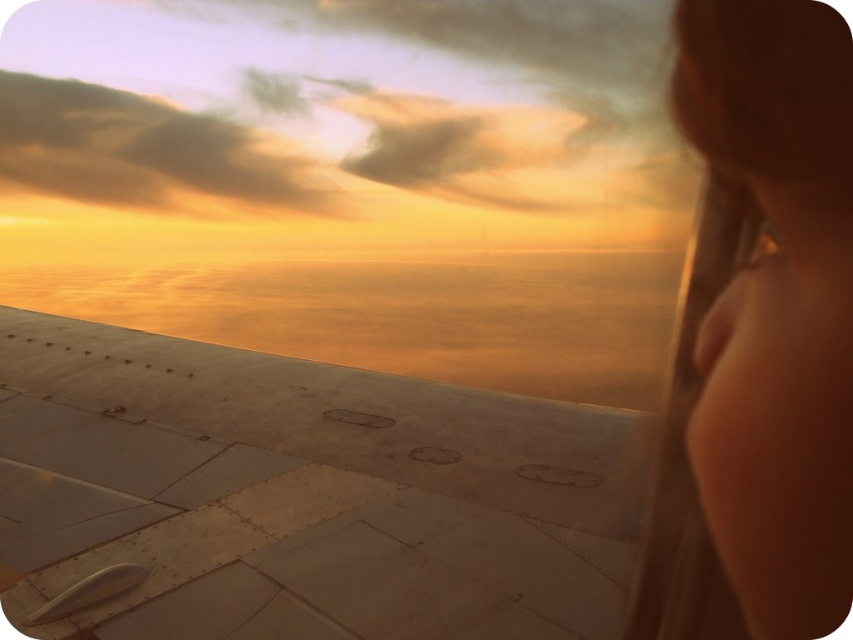
You are a passenger sitting in the airplane and looking out the window. You notice a smooth skin face at upper right and a cloudy orange sky at upper left. Which of these two objects is closer to the bottom edge of the window?

The smooth skin face at upper right is located below the cloudy orange sky at upper left, meaning it is closer to the bottom edge of the window.

You are seated in the airplane and want to know how far the point at coordinates point (x=791, y=60) is from your eyes. Can you determine the distance?

The distance of point (x=791, y=60) from viewer is 11.30 inches.

You are sitting in an airplane seat and looking out the window. You see the metallic gray wing at lower left and the cloudy orange sky at upper left. Which object is closer to the left side of the window?

The cloudy orange sky at upper left is closer to the left side of the window because the metallic gray wing at lower left is positioned on the right side of it.